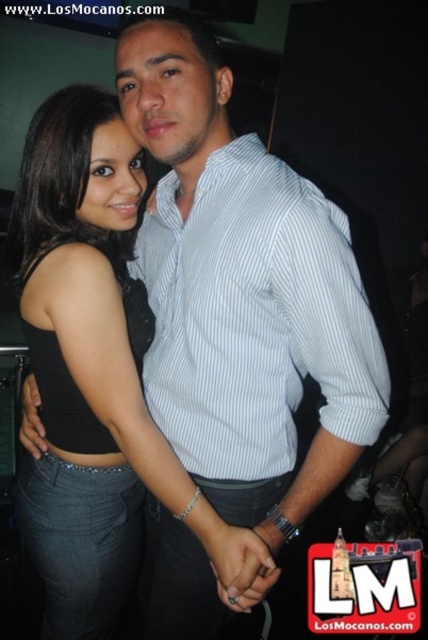
Question: Is black matte tank top at center positioned at the back of white striped shirt at center?

Choices:
 (A) no
 (B) yes

Answer: (B)

Question: Considering the relative positions of black matte tank top at center and white striped shirt at center in the image provided, where is black matte tank top at center located with respect to white striped shirt at center?

Choices:
 (A) right
 (B) left

Answer: (B)

Question: Which of the following is the farthest from the observer?

Choices:
 (A) black matte tank top at center
 (B) white striped shirt at center

Answer: (A)

Question: Which of the following is the farthest from the observer?

Choices:
 (A) white striped shirt at center
 (B) black matte tank top at center

Answer: (B)

Question: Does black matte tank top at center appear over white striped shirt at center?

Choices:
 (A) yes
 (B) no

Answer: (B)